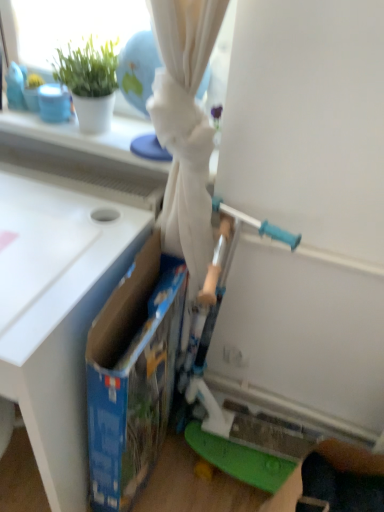
What is the approximate width of white matte table at left?

53.05 centimeters.

In order to face white matte table at left, should I rotate leftwards or rightwards?

You should look left and rotate roughly 23.669 degrees.

The width and height of the screenshot is (384, 512). Describe the element at coordinates (57, 314) in the screenshot. I see `white matte table at left` at that location.

Measure the distance between white matte table at left and camera.

A distance of 68.78 centimeters exists between white matte table at left and camera.

Image resolution: width=384 pixels, height=512 pixels. I want to click on white matte table at left, so [57, 314].

What is the approximate width of blue cardboard box at center?

blue cardboard box at center is 13.37 centimeters wide.

Locate an element on the screen. The height and width of the screenshot is (512, 384). blue cardboard box at center is located at coordinates (133, 375).

Describe the element at coordinates (133, 375) in the screenshot. This screenshot has width=384, height=512. I see `blue cardboard box at center` at that location.

The image size is (384, 512). What are the coordinates of `white matte table at left` in the screenshot? It's located at (57, 314).

Which object is positioned more to the left, white matte table at left or blue cardboard box at center?

white matte table at left is more to the left.

Is white matte table at left further to the viewer compared to blue cardboard box at center?

No.

Does point (15, 218) come behind point (150, 314)?

No.

From the image's perspective, is white matte table at left located above or below blue cardboard box at center?

From the image's perspective, white matte table at left appears above blue cardboard box at center.

From a real-world perspective, between white matte table at left and blue cardboard box at center, who is vertically higher?

white matte table at left.

Can you confirm if white matte table at left is wider than blue cardboard box at center?

Correct, the width of white matte table at left exceeds that of blue cardboard box at center.

Does white matte table at left have a greater height compared to blue cardboard box at center?

Indeed, white matte table at left has a greater height compared to blue cardboard box at center.

Consider the image. Can you confirm if white matte table at left is smaller than blue cardboard box at center?

No, white matte table at left is not smaller than blue cardboard box at center.

From the picture: Which is correct: white matte table at left is inside blue cardboard box at center, or outside of it?

The correct answer is: outside.

From the picture: Are white matte table at left and blue cardboard box at center far apart?

That's not correct — white matte table at left is a little close to blue cardboard box at center.

Could you tell me if white matte table at left is turned towards blue cardboard box at center?

No, white matte table at left is not oriented towards blue cardboard box at center.

Where is `table above the blue cardboard box at center (from the image's perspective)`? table above the blue cardboard box at center (from the image's perspective) is located at coordinates (57, 314).

Considering the relative positions of blue cardboard box at center and white matte table at left in the image provided, is blue cardboard box at center to the right of white matte table at left from the viewer's perspective?

Correct, you'll find blue cardboard box at center to the right of white matte table at left.

Who is more distant, blue cardboard box at center or white matte table at left?

blue cardboard box at center is further away from the camera.

Considering the points (128, 459) and (45, 341), which point is behind, point (128, 459) or point (45, 341)?

Positioned behind is point (128, 459).

From the image's perspective, is blue cardboard box at center beneath white matte table at left?

Yes, from the image's perspective, blue cardboard box at center is beneath white matte table at left.

From a real-world perspective, which is physically below, blue cardboard box at center or white matte table at left?

In real-world perspective, blue cardboard box at center is lower.

Can you confirm if blue cardboard box at center is thinner than white matte table at left?

Yes.

Considering the sizes of objects blue cardboard box at center and white matte table at left in the image provided, who is shorter, blue cardboard box at center or white matte table at left?

Standing shorter between the two is blue cardboard box at center.

Who is bigger, blue cardboard box at center or white matte table at left?

white matte table at left.

Can we say blue cardboard box at center lies outside white matte table at left?

Indeed, blue cardboard box at center is completely outside white matte table at left.

Is blue cardboard box at center positioned far away from white matte table at left?

No, there isn't a large distance between blue cardboard box at center and white matte table at left.

Could you tell me if blue cardboard box at center is facing white matte table at left?

Yes, blue cardboard box at center is oriented towards white matte table at left.

Can you tell me how much blue cardboard box at center and white matte table at left differ in facing direction?

The facing directions of blue cardboard box at center and white matte table at left are 91.6 degrees apart.

At what (x,y) coordinates should I click in order to perform the action: click on storage box behind the white matte table at left. Please return your answer as a coordinate pair (x, y). Looking at the image, I should click on (133, 375).

Identify the location of storage box below the white matte table at left (from the image's perspective). The image size is (384, 512). (133, 375).

Where is `table on the left of blue cardboard box at center`? Image resolution: width=384 pixels, height=512 pixels. table on the left of blue cardboard box at center is located at coordinates (57, 314).